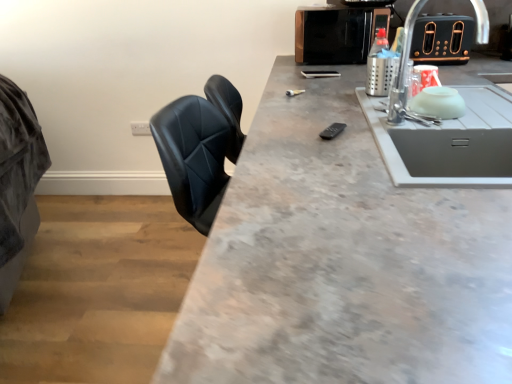
Question: Is gray concrete countertop at center thinner than black metallic toaster at upper right, the second appliance in the left-to-right sequence?

Choices:
 (A) yes
 (B) no

Answer: (B)

Question: Could you tell me if gray concrete countertop at center is turned towards black metallic toaster at upper right, which ranks as the 1th appliance in right-to-left order?

Choices:
 (A) yes
 (B) no

Answer: (B)

Question: From a real-world perspective, is gray concrete countertop at center positioned under black metallic toaster at upper right, which ranks as the 1th appliance in right-to-left order, based on gravity?

Choices:
 (A) no
 (B) yes

Answer: (B)

Question: Can you confirm if gray concrete countertop at center is smaller than black metallic toaster at upper right, the second appliance in the left-to-right sequence?

Choices:
 (A) no
 (B) yes

Answer: (A)

Question: Can you confirm if gray concrete countertop at center is shorter than black metallic toaster at upper right, the second appliance in the left-to-right sequence?

Choices:
 (A) no
 (B) yes

Answer: (A)

Question: From the image's perspective, is metallic microwave at upper right, which appears as the 2th appliance when viewed from the right, above or below metallic silver bottle at upper right?

Choices:
 (A) above
 (B) below

Answer: (A)

Question: Considering the positions of point pos(300,11) and point pos(391,79), is point pos(300,11) closer or farther from the camera than point pos(391,79)?

Choices:
 (A) closer
 (B) farther

Answer: (B)

Question: Considering the positions of metallic microwave at upper right, the 1th appliance when ordered from left to right, and metallic silver bottle at upper right in the image, is metallic microwave at upper right, the 1th appliance when ordered from left to right, taller or shorter than metallic silver bottle at upper right?

Choices:
 (A) tall
 (B) short

Answer: (A)

Question: In the image, is metallic microwave at upper right, which appears as the 2th appliance when viewed from the right, positioned in front of or behind metallic silver bottle at upper right?

Choices:
 (A) front
 (B) behind

Answer: (B)

Question: Looking at their shapes, would you say white plastic electric outlet at upper center is wider or thinner than gray concrete countertop at center?

Choices:
 (A) wide
 (B) thin

Answer: (B)

Question: From their relative heights in the image, would you say white plastic electric outlet at upper center is taller or shorter than gray concrete countertop at center?

Choices:
 (A) short
 (B) tall

Answer: (A)

Question: Do you think white plastic electric outlet at upper center is within gray concrete countertop at center, or outside of it?

Choices:
 (A) inside
 (B) outside

Answer: (B)

Question: Considering the positions of point (143, 127) and point (331, 276), is point (143, 127) closer or farther from the camera than point (331, 276)?

Choices:
 (A) farther
 (B) closer

Answer: (A)

Question: Considering the positions of white plastic electric outlet at upper center and metallic silver bottle at upper right in the image, is white plastic electric outlet at upper center taller or shorter than metallic silver bottle at upper right?

Choices:
 (A) tall
 (B) short

Answer: (B)

Question: From the image's perspective, is white plastic electric outlet at upper center above or below metallic silver bottle at upper right?

Choices:
 (A) below
 (B) above

Answer: (A)